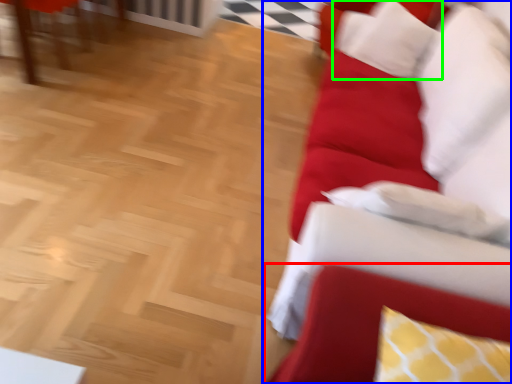
Question: Which is farther away from swivel chair (highlighted by a red box)? studio couch (highlighted by a blue box) or pillow (highlighted by a green box)?

Choices:
 (A) studio couch
 (B) pillow

Answer: (B)